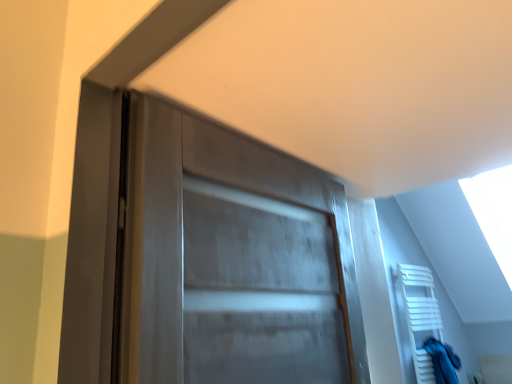
Describe the element at coordinates (420, 315) in the screenshot. I see `white wooden towel rack at lower right` at that location.

Identify the location of white wooden towel rack at lower right. [x=420, y=315].

Image resolution: width=512 pixels, height=384 pixels. Describe the element at coordinates (443, 361) in the screenshot. I see `blue fabric at right` at that location.

The width and height of the screenshot is (512, 384). I want to click on blue fabric at right, so click(x=443, y=361).

The width and height of the screenshot is (512, 384). In order to click on white wooden towel rack at lower right in this screenshot , I will do `click(420, 315)`.

Which is more to the left, blue fabric at right or white wooden towel rack at lower right?

white wooden towel rack at lower right is more to the left.

Is blue fabric at right in front of white wooden towel rack at lower right?

No, blue fabric at right is behind white wooden towel rack at lower right.

Which point is more forward, [447,360] or [430,355]?

The point [447,360] is more forward.

From the image's perspective, would you say blue fabric at right is shown under white wooden towel rack at lower right?

Indeed, from the image's perspective, blue fabric at right is shown beneath white wooden towel rack at lower right.

From a real-world perspective, is blue fabric at right over white wooden towel rack at lower right?

No, from a real-world perspective, blue fabric at right is not above white wooden towel rack at lower right.

Can you confirm if blue fabric at right is thinner than white wooden towel rack at lower right?

Indeed, blue fabric at right has a lesser width compared to white wooden towel rack at lower right.

Considering the relative sizes of blue fabric at right and white wooden towel rack at lower right in the image provided, is blue fabric at right taller than white wooden towel rack at lower right?

No.

Based on the photo, considering the relative sizes of blue fabric at right and white wooden towel rack at lower right in the image provided, is blue fabric at right bigger than white wooden towel rack at lower right?

No.

Is blue fabric at right inside the boundaries of white wooden towel rack at lower right, or outside?

blue fabric at right fits inside white wooden towel rack at lower right.

Is blue fabric at right far from white wooden towel rack at lower right?

No, there isn't a large distance between blue fabric at right and white wooden towel rack at lower right.

Is blue fabric at right turned away from white wooden towel rack at lower right?

Yes, blue fabric at right's orientation is away from white wooden towel rack at lower right.

Identify the location of shelf above the blue fabric at right (from the image's perspective). Image resolution: width=512 pixels, height=384 pixels. (420, 315).

Is white wooden towel rack at lower right at the right side of blue fabric at right?

No.

Is white wooden towel rack at lower right positioned behind blue fabric at right?

No, it is in front of blue fabric at right.

Is point (420, 362) positioned behind point (446, 347)?

That is False.

From the image's perspective, which one is positioned higher, white wooden towel rack at lower right or blue fabric at right?

white wooden towel rack at lower right, from the image's perspective.

From a real-world perspective, which object rests below the other?

blue fabric at right, from a real-world perspective.

In terms of width, does white wooden towel rack at lower right look wider or thinner when compared to blue fabric at right?

Clearly, white wooden towel rack at lower right has more width compared to blue fabric at right.

Is white wooden towel rack at lower right taller than blue fabric at right?

Correct, white wooden towel rack at lower right is much taller as blue fabric at right.

Does white wooden towel rack at lower right have a larger size compared to blue fabric at right?

Indeed, white wooden towel rack at lower right has a larger size compared to blue fabric at right.

Is white wooden towel rack at lower right located outside blue fabric at right?

Yes, white wooden towel rack at lower right is located beyond the bounds of blue fabric at right.

Are white wooden towel rack at lower right and blue fabric at right located far from each other?

No, white wooden towel rack at lower right is not far from blue fabric at right.

Based on the photo, is blue fabric at right at the back of white wooden towel rack at lower right?

That's right, white wooden towel rack at lower right is facing away from blue fabric at right.

In the scene shown: How different are the orientations of white wooden towel rack at lower right and blue fabric at right in degrees?

There is a 0.000398-degree angle between the facing directions of white wooden towel rack at lower right and blue fabric at right.

At what (x,y) coordinates should I click in order to perform the action: click on scrub on the right of white wooden towel rack at lower right. Please return your answer as a coordinate pair (x, y). Looking at the image, I should click on (443, 361).

I want to click on shelf that appears in front of the blue fabric at right, so click(x=420, y=315).

At what (x,y) coordinates should I click in order to perform the action: click on shelf above the blue fabric at right (from a real-world perspective). Please return your answer as a coordinate pair (x, y). Looking at the image, I should click on (420, 315).